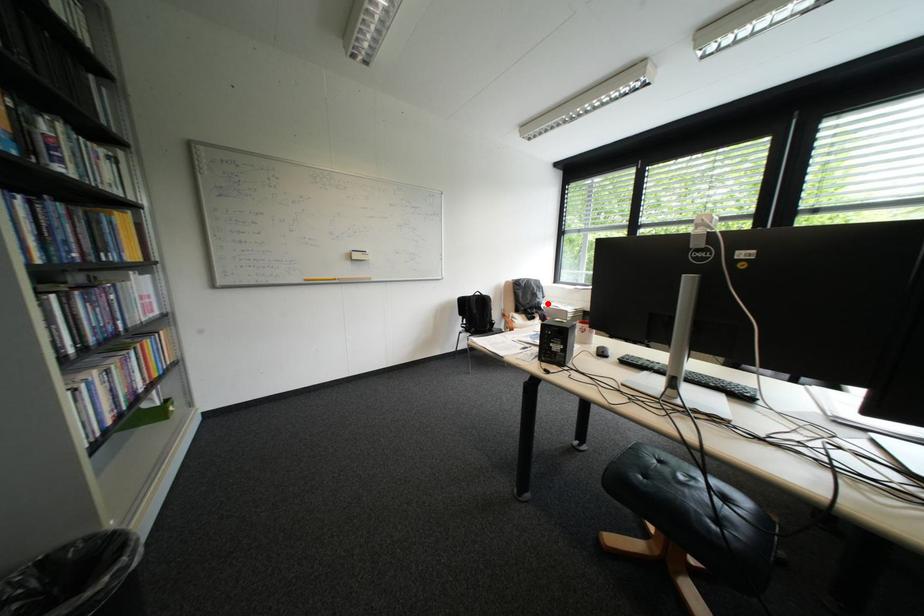
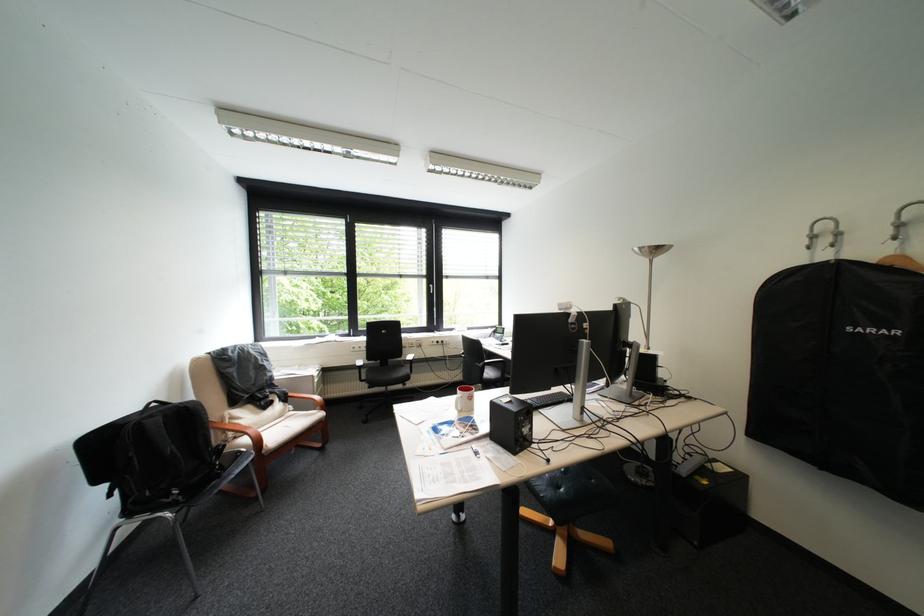
The point at the highlighted location is marked in the first image. Where is the corresponding point in the second image?

(280, 381)